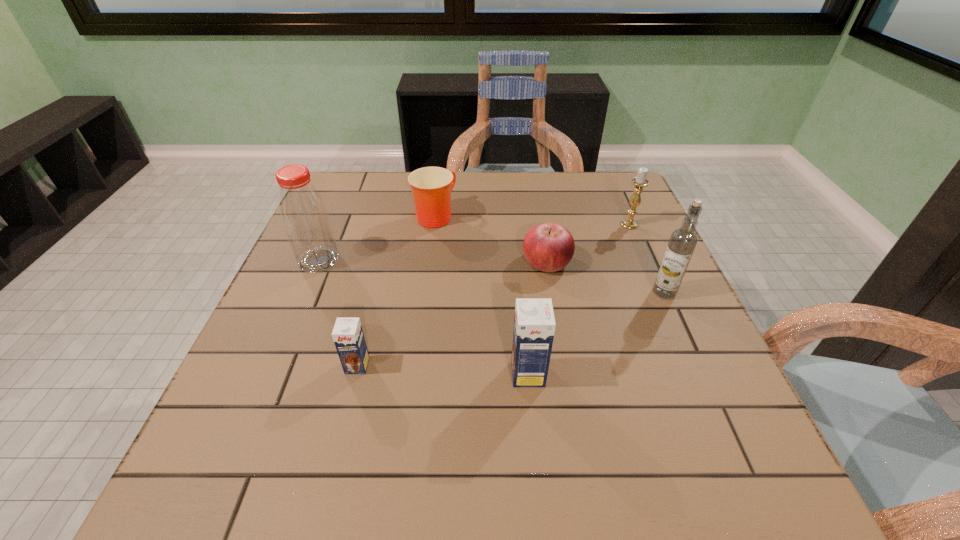
Considering the uniform spacing of chocolate milks, where should an additional chocolate milk be positioned on the right? Please locate a free spot. Please provide its 2D coordinates. Your answer should be formatted as a tuple, i.e. [(x, y)], where the tuple contains the x and y coordinates of a point satisfying the conditions above.

[(705, 382)]